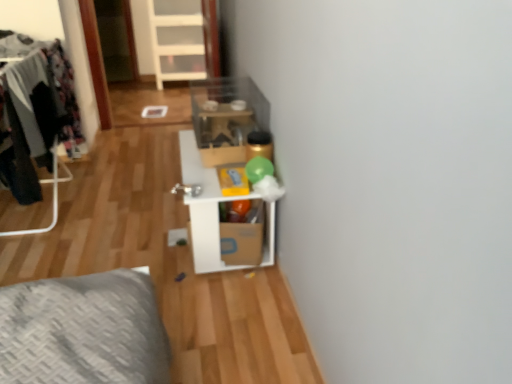
Question: In terms of height, does dark gray fabric clothes at left look taller or shorter compared to cardboard box at center?

Choices:
 (A) tall
 (B) short

Answer: (A)

Question: In the image, is dark gray fabric clothes at left positioned in front of or behind cardboard box at center?

Choices:
 (A) front
 (B) behind

Answer: (A)

Question: Estimate the real-world distances between objects in this image. Which object is farther from the white cardboard shelf at center?

Choices:
 (A) cardboard box at center
 (B) dark gray fabric clothes at left
 (C) white plastic ladder at upper center

Answer: (C)

Question: Which of these objects is positioned farthest from the white plastic ladder at upper center?

Choices:
 (A) dark gray fabric clothes at left
 (B) cardboard box at center
 (C) white cardboard shelf at center

Answer: (B)